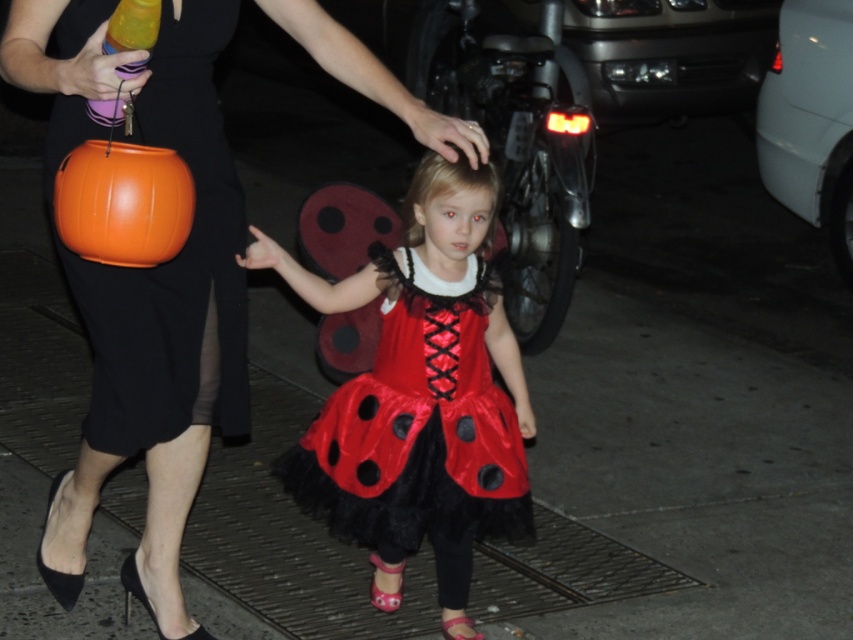
Based on the scene description, where is the matte black dress at center in relation to the orange plastic bucket at left?

The matte black dress at center is to the right of the orange plastic bucket at left.

You are standing in front of the scene and want to reach both the point at coordinates point (335, 516) and point (160, 372). Which point is closer to you?

Point (160, 372) is closer to you because it is closer to the camera than point (335, 516), which is further away.